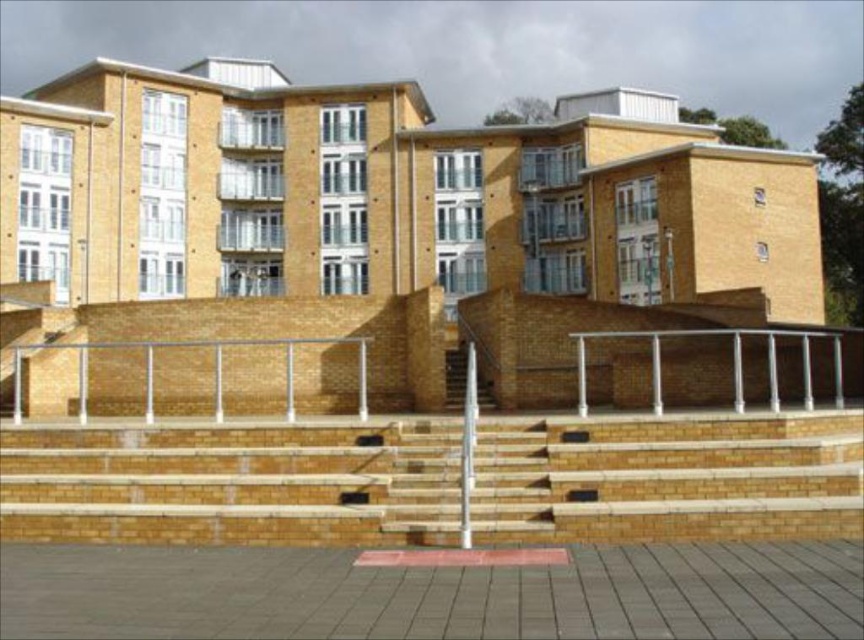
Who is taller, silver metallic rail at center or smooth concrete stairs at center?

Standing taller between the two is silver metallic rail at center.

The width and height of the screenshot is (864, 640). What are the coordinates of `silver metallic rail at center` in the screenshot? It's located at (731, 362).

The image size is (864, 640). What are the coordinates of `silver metallic rail at center` in the screenshot? It's located at (731, 362).